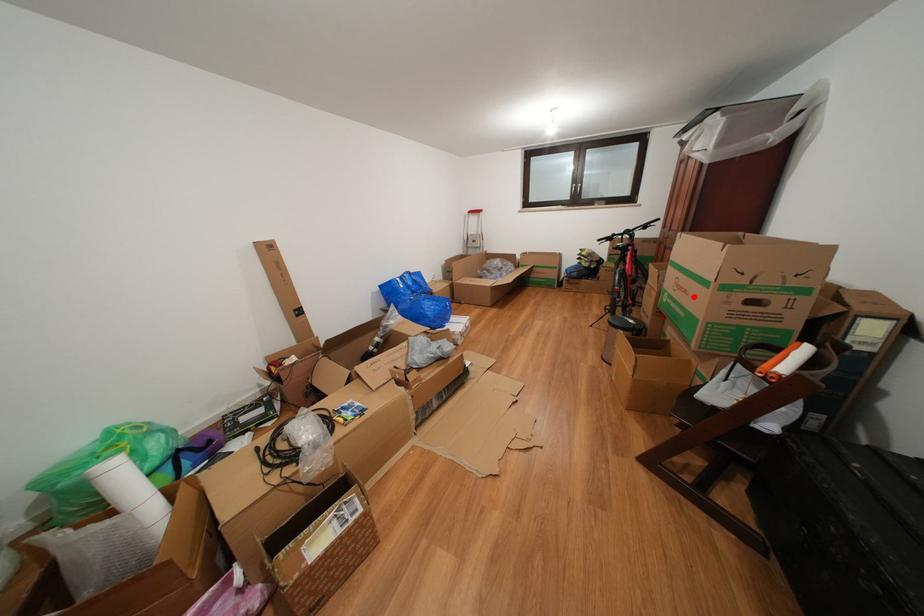
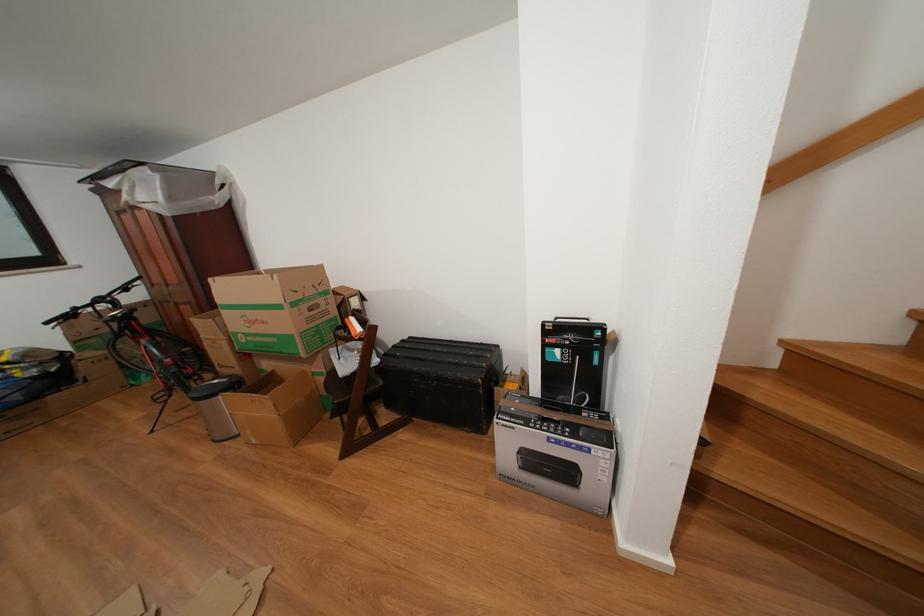
Question: I am providing you with two images of the same scene from different viewpoints. A red point is marked on the first image. At the location where the point appears in image 1, is it still visible in image 2?

Choices:
 (A) Yes
 (B) No

Answer: (A)